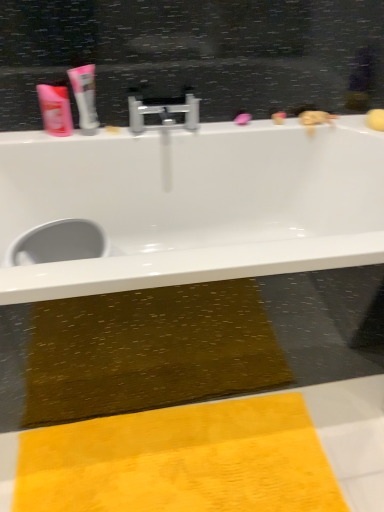
The width and height of the screenshot is (384, 512). In order to click on vacant space to the left of white glossy tube at upper left in this screenshot , I will do `click(44, 137)`.